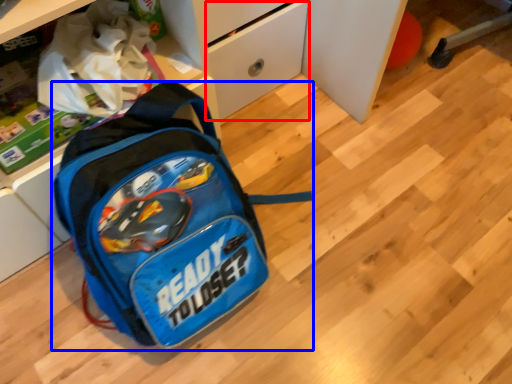
Question: Among these objects, which one is nearest to the camera, drawer (highlighted by a red box) or backpack (highlighted by a blue box)?

Choices:
 (A) drawer
 (B) backpack

Answer: (B)